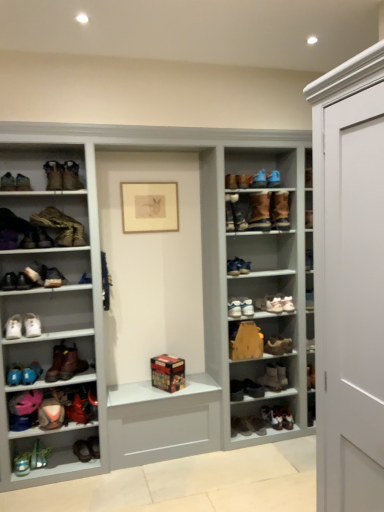
Find the location of a particular element. The height and width of the screenshot is (512, 384). free space on the front side of shiny brown boot at lower left, positioned as the twentieth footwear in top-to-bottom order is located at coordinates (36, 480).